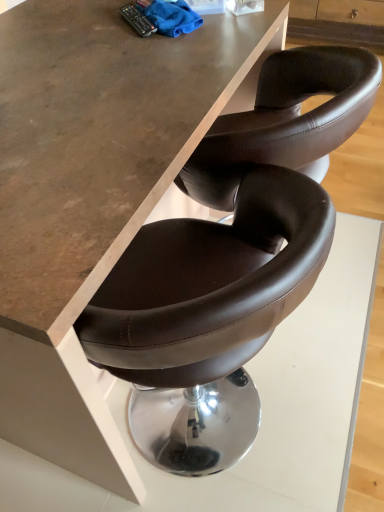
Locate an element on the screen. The image size is (384, 512). vacant area that lies to the right of blue microfiber cloth at upper center is located at coordinates (236, 28).